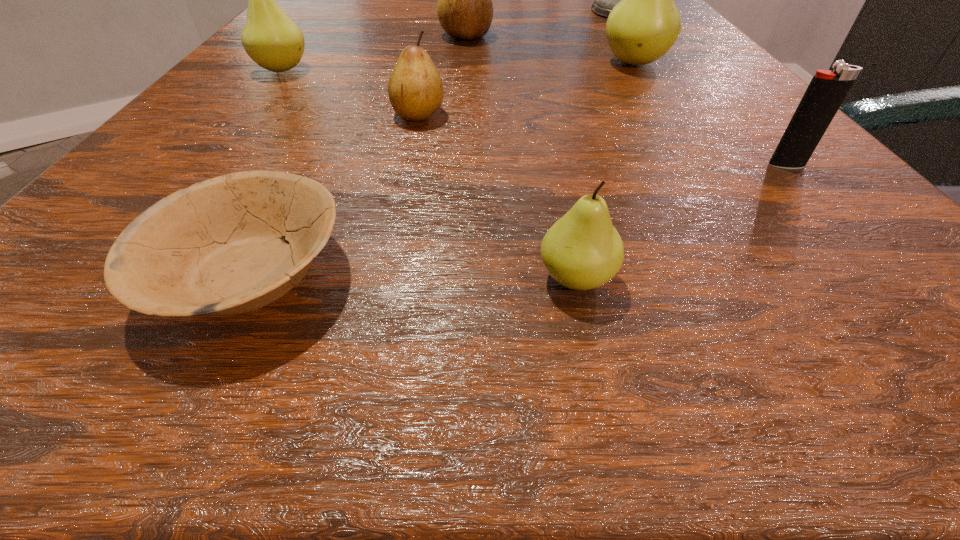
Identify the location of pear that is at the right edge. Image resolution: width=960 pixels, height=540 pixels. (644, 25).

Identify the location of igniter that is at the right edge. (827, 90).

Image resolution: width=960 pixels, height=540 pixels. What are the coordinates of `object that is at the near left corner` in the screenshot? It's located at tap(215, 248).

At what (x,y) coordinates should I click in order to perform the action: click on object positioned at the far right corner. Please return your answer as a coordinate pair (x, y). This screenshot has width=960, height=540. Looking at the image, I should click on (604, 0).

You are a GUI agent. You are given a task and a screenshot of the screen. Output one action in this format:
    pyautogui.click(x=<x>, y=<y>)
    Task: Click on the blank space at the far edge of the desktop
    The width and height of the screenshot is (960, 540).
    Given the screenshot: What is the action you would take?
    pyautogui.click(x=585, y=30)

This screenshot has height=540, width=960. Find the location of `free spot at the near edge of the desktop`. free spot at the near edge of the desktop is located at coordinates pos(378,282).

Where is `free region at the left edge of the desktop`? free region at the left edge of the desktop is located at coordinates (297, 100).

Locate an element on the screen. This screenshot has width=960, height=540. vacant area at the right edge of the desktop is located at coordinates (827, 195).

Where is `vacant space at the near left corner of the desktop`? This screenshot has height=540, width=960. vacant space at the near left corner of the desktop is located at coordinates (110, 305).

I want to click on vacant region between the farther brown pear and the bowl, so click(358, 155).